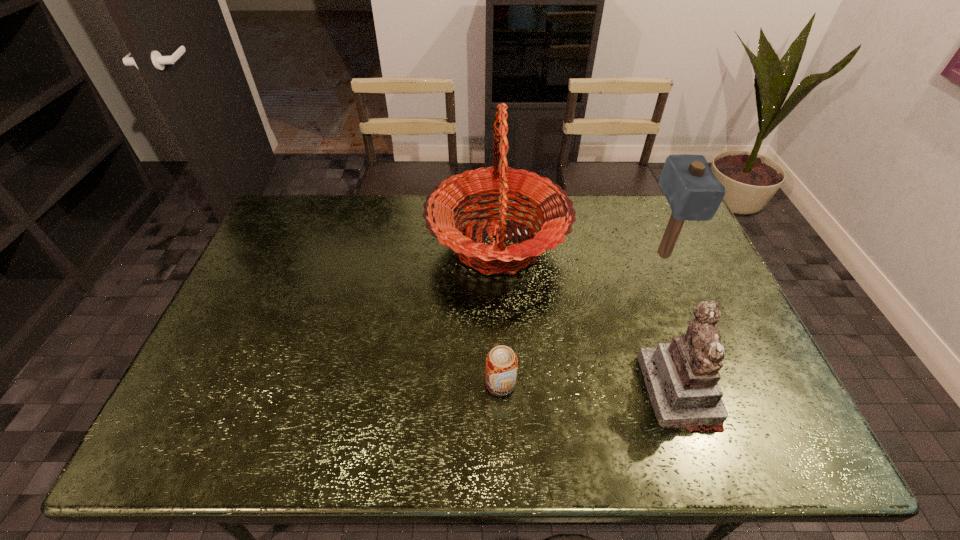
You are a GUI agent. You are given a task and a screenshot of the screen. Output one action in this format:
    pyautogui.click(x=<x>, y=<y>)
    Task: Click on the basket located in the far edge section of the desktop
    Image resolution: width=960 pixels, height=540 pixels.
    Given the screenshot: What is the action you would take?
    pyautogui.click(x=553, y=208)

Where is `mallet present at the far edge`? The height and width of the screenshot is (540, 960). mallet present at the far edge is located at coordinates (693, 192).

Find the location of a particular element. object at the near edge is located at coordinates (681, 377).

Locate an element on the screen. mallet located in the right edge section of the desktop is located at coordinates (693, 192).

Where is `figurine present at the right edge`? The width and height of the screenshot is (960, 540). figurine present at the right edge is located at coordinates (681, 377).

The image size is (960, 540). Identify the location of object that is at the far right corner. (693, 192).

Where is `object present at the near right corner`? object present at the near right corner is located at coordinates (681, 377).

Locate an element on the screen. The image size is (960, 540). free space at the far edge of the desktop is located at coordinates (350, 222).

I want to click on blank space at the near edge, so click(306, 443).

The width and height of the screenshot is (960, 540). In the image, there is a desktop. What are the coordinates of `vacant area at the left edge` in the screenshot? It's located at (216, 394).